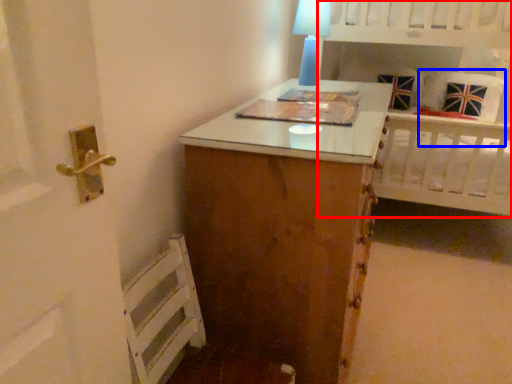
Question: Which object is further to the camera taking this photo, bed (highlighted by a red box) or pillow (highlighted by a blue box)?

Choices:
 (A) bed
 (B) pillow

Answer: (B)